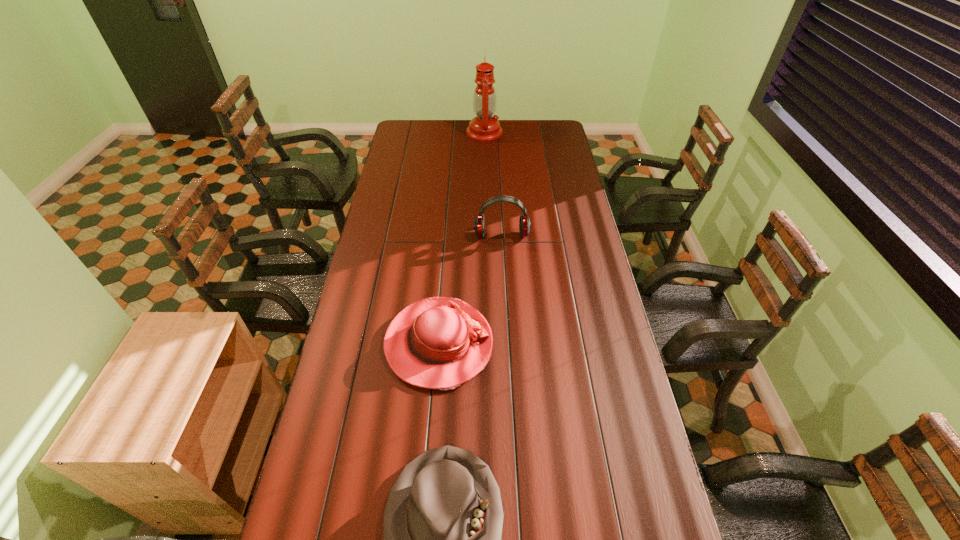
Locate an element on the screen. The image size is (960, 540). the tallest object is located at coordinates click(484, 127).

Where is `oil lamp`? oil lamp is located at coordinates (484, 127).

Identify the location of the second farthest object. The height and width of the screenshot is (540, 960). (524, 223).

The height and width of the screenshot is (540, 960). What are the coordinates of `the second tallest object` in the screenshot? It's located at (524, 223).

Where is `the farther hat`? the farther hat is located at coordinates (440, 343).

Identify the location of free space located 0.310m on the left of the oil lamp. This screenshot has width=960, height=540. click(x=409, y=132).

Where is `vacant space located on the ear cups of the third shortest object`? vacant space located on the ear cups of the third shortest object is located at coordinates (505, 305).

You are a GUI agent. You are given a task and a screenshot of the screen. Output one action in this format:
    pyautogui.click(x=<x>, y=<y>)
    Task: Click on the free location located 0.270m at the front of the farther hat with a bow
    
    Given the screenshot: What is the action you would take?
    pyautogui.click(x=576, y=344)

At what (x,y) coordinates should I click in order to perform the action: click on object situated at the far edge. Please return your answer as a coordinate pair (x, y). Image resolution: width=960 pixels, height=540 pixels. Looking at the image, I should click on (484, 127).

Find the location of a particular element. object that is positioned at the left edge is located at coordinates (440, 343).